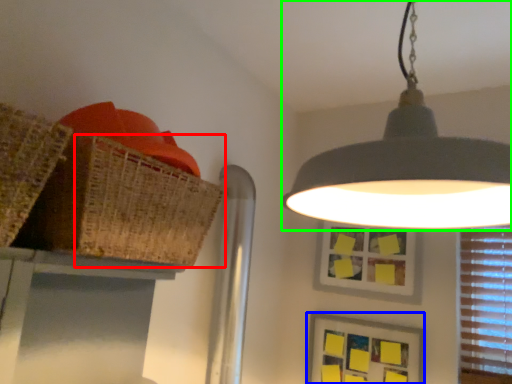
Question: Considering the real-world distances, which object is closest to basket (highlighted by a red box)? picture frame (highlighted by a blue box) or lamp (highlighted by a green box).

Choices:
 (A) picture frame
 (B) lamp

Answer: (B)